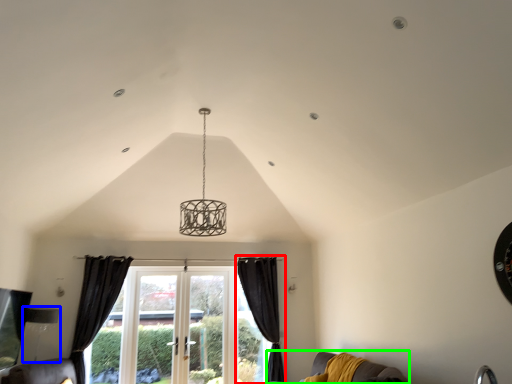
Question: Based on their relative distances, which object is farther from curtain (highlighted by a red box)? Choose from lamp (highlighted by a blue box) and couch (highlighted by a green box).

Choices:
 (A) lamp
 (B) couch

Answer: (A)